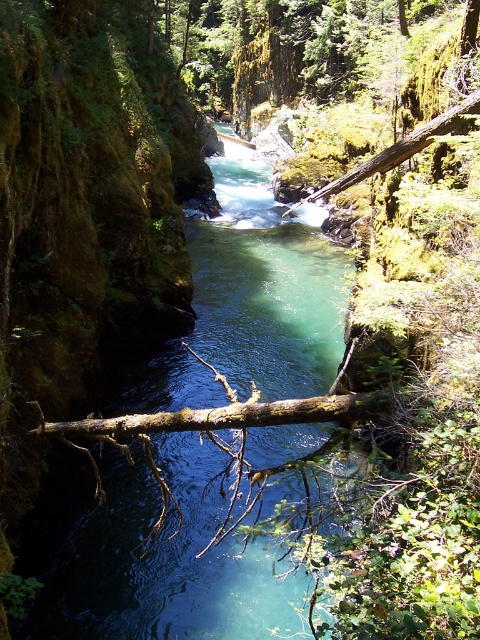
Does clear water at center appear on the left side of brown rough log at center?

Incorrect, clear water at center is not on the left side of brown rough log at center.

Is point (260, 288) in front of point (205, 420)?

No.

Find the location of a particular element. Image resolution: width=480 pixels, height=640 pixels. clear water at center is located at coordinates tap(158, 560).